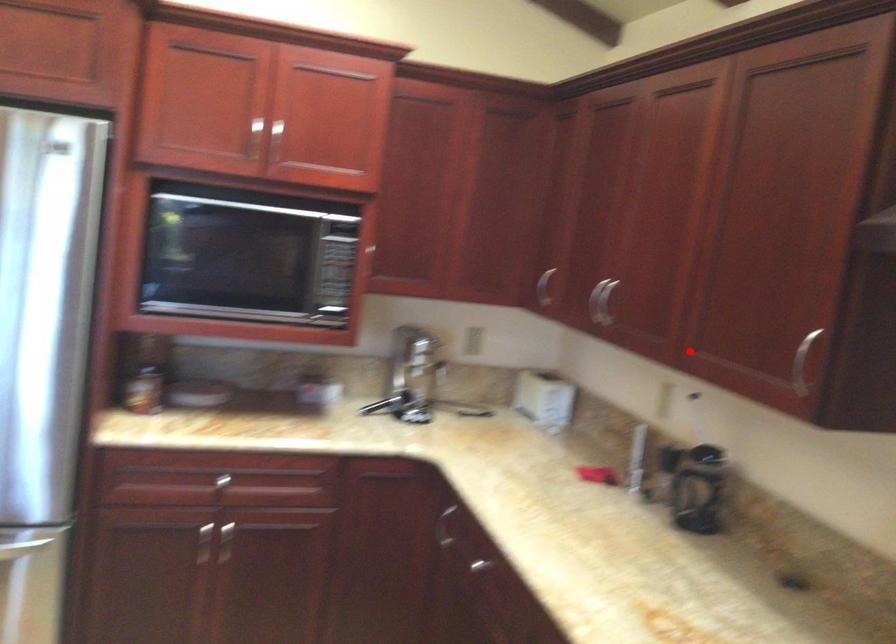
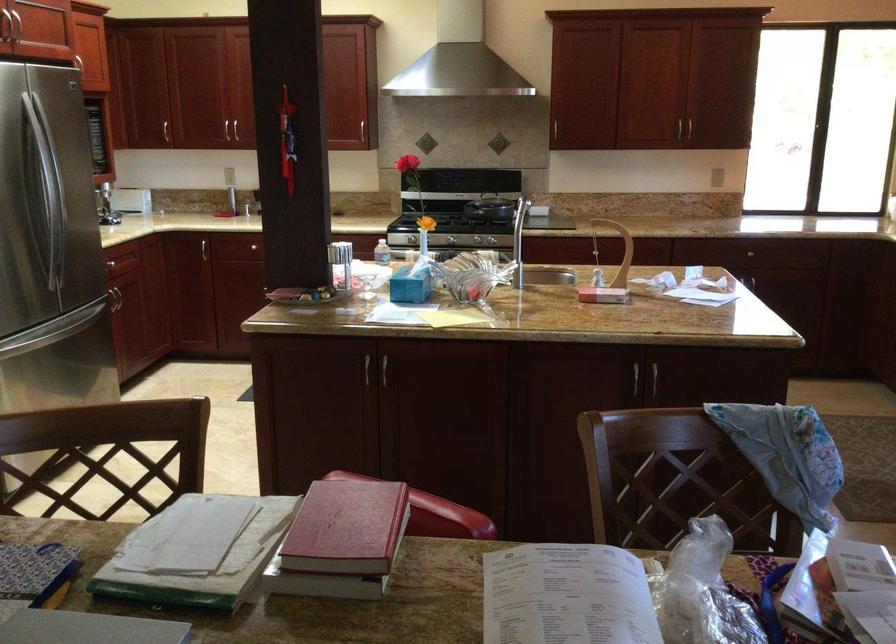
Question: I am providing you with two images of the same scene from different viewpoints. A red point is shown in image1. For the corresponding object point in image2, is it positioned nearer or farther from the camera?

Choices:
 (A) Nearer
 (B) Farther

Answer: (B)